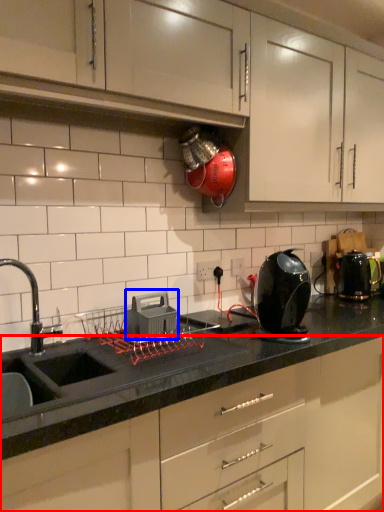
Question: Which point is further to the camera, cabinetry (highlighted by a red box) or appliance (highlighted by a blue box)?

Choices:
 (A) cabinetry
 (B) appliance

Answer: (B)